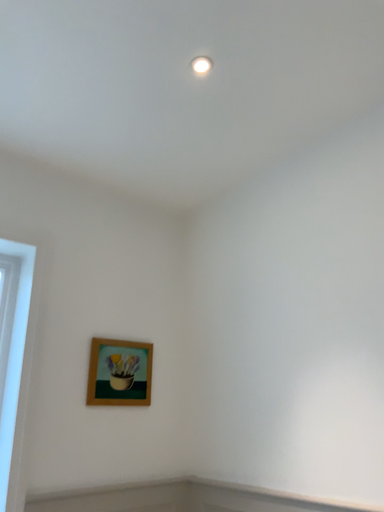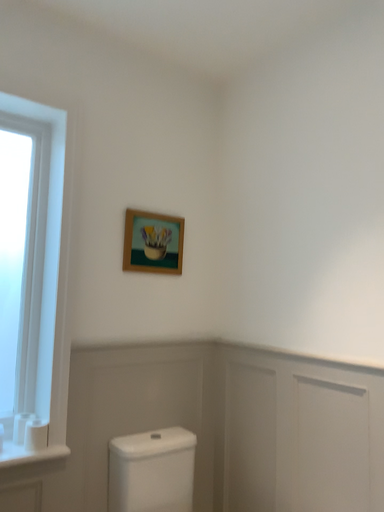
Question: Which way did the camera rotate in the video?

Choices:
 (A) rotated upward
 (B) rotated downward

Answer: (B)